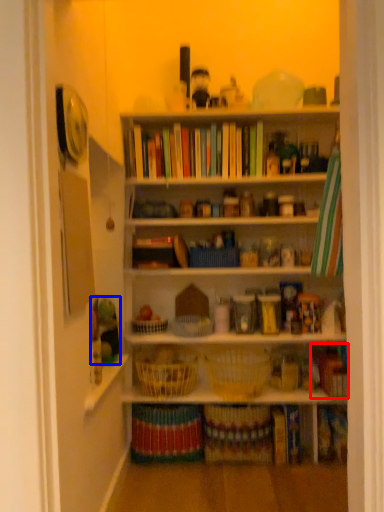
Question: Among these objects, which one is nearest to the camera, book (highlighted by a red box) or toy (highlighted by a blue box)?

Choices:
 (A) book
 (B) toy

Answer: (A)